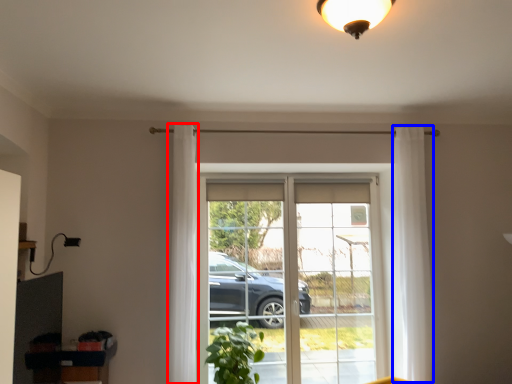
Question: Which point is closer to the camera, curtain (highlighted by a red box) or curtain (highlighted by a blue box)?

Choices:
 (A) curtain
 (B) curtain

Answer: (A)